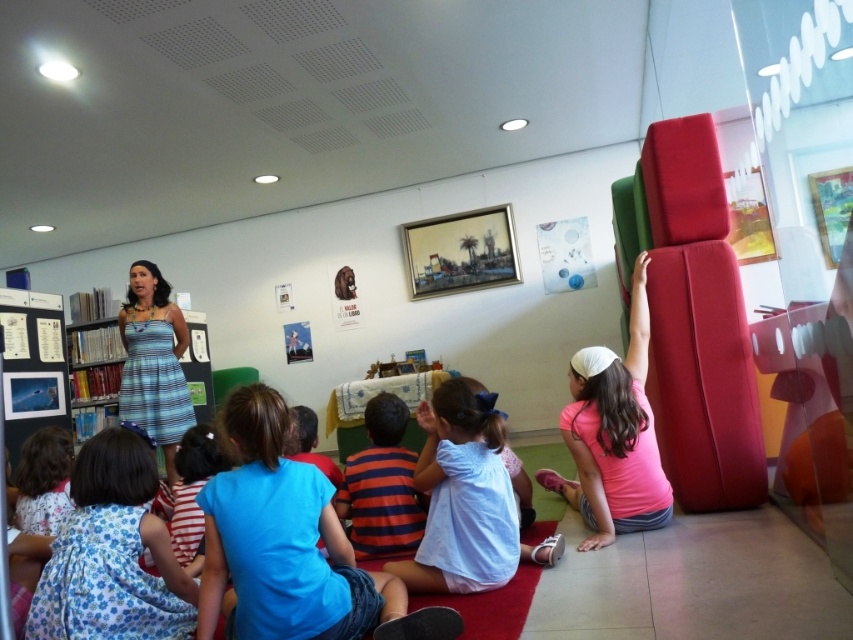
Does light blue cotton shirt at center have a lesser width compared to blue striped dress at center?

Correct, light blue cotton shirt at center's width is less than blue striped dress at center's.

Between point (439, 410) and point (131, 320), which one is positioned behind?

Point (131, 320)

The width and height of the screenshot is (853, 640). Find the location of `light blue cotton shirt at center`. light blue cotton shirt at center is located at coordinates (466, 499).

Does light blue cotton shirt at center have a greater width compared to pink matte shirt at right?

Yes.

Who is more forward, [502,502] or [646,422]?

Point [502,502] is more forward.

Which is behind, point (401, 564) or point (553, 476)?

Positioned behind is point (553, 476).

In order to click on light blue cotton shirt at center in this screenshot , I will do `click(466, 499)`.

Does floral cotton dress at lower left have a lesser height compared to blue striped dress at center?

Yes.

Which is in front, point (148, 577) or point (120, 378)?

Point (148, 577) is in front.

I want to click on floral cotton dress at lower left, so click(x=112, y=552).